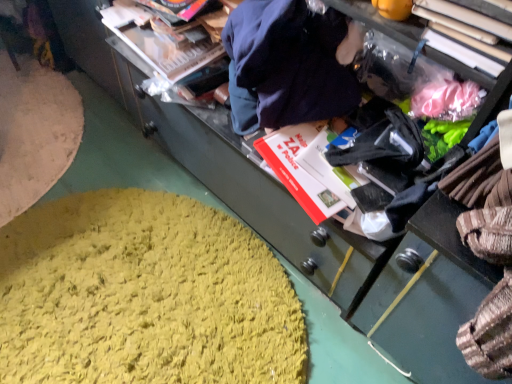
I want to click on vacant area situated below yellow shaggy rug at lower left (from a real-world perspective), so [x=145, y=332].